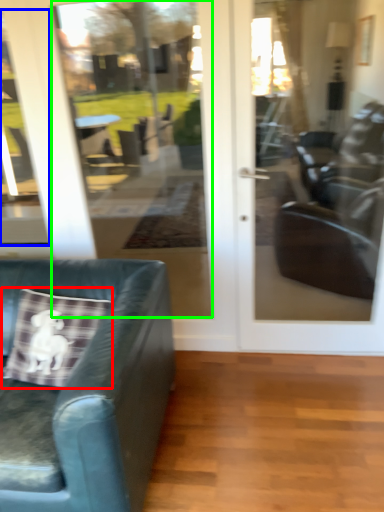
Question: Estimate the real-world distances between objects in this image. Which object is farther from throw pillow (highlighted by a red box), window (highlighted by a blue box) or glass door (highlighted by a green box)?

Choices:
 (A) window
 (B) glass door

Answer: (B)